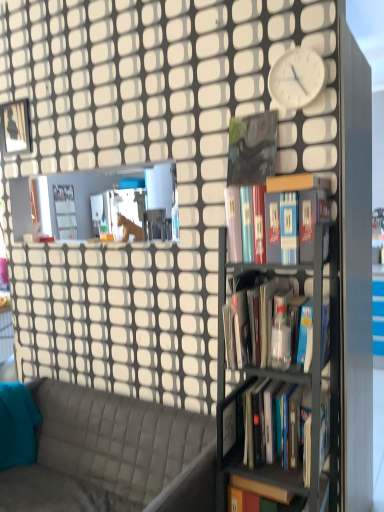
Question: Is metallic gray bookshelf at right directly adjacent to white matte clock at upper right?

Choices:
 (A) no
 (B) yes

Answer: (A)

Question: Is metallic gray bookshelf at right oriented away from white matte clock at upper right?

Choices:
 (A) yes
 (B) no

Answer: (B)

Question: Is metallic gray bookshelf at right wider than white matte clock at upper right?

Choices:
 (A) yes
 (B) no

Answer: (A)

Question: Considering the relative sizes of metallic gray bookshelf at right and white matte clock at upper right in the image provided, is metallic gray bookshelf at right smaller than white matte clock at upper right?

Choices:
 (A) yes
 (B) no

Answer: (B)

Question: From a real-world perspective, is metallic gray bookshelf at right below white matte clock at upper right?

Choices:
 (A) no
 (B) yes

Answer: (B)

Question: Considering their positions, is teal fabric pillow at left located in front of or behind white matte clock at upper right?

Choices:
 (A) behind
 (B) front

Answer: (A)

Question: Considering the positions of point (33, 400) and point (268, 82), is point (33, 400) closer or farther from the camera than point (268, 82)?

Choices:
 (A) farther
 (B) closer

Answer: (A)

Question: Is teal fabric pillow at left situated inside white matte clock at upper right or outside?

Choices:
 (A) inside
 (B) outside

Answer: (B)

Question: Is teal fabric pillow at left bigger or smaller than white matte clock at upper right?

Choices:
 (A) big
 (B) small

Answer: (A)

Question: Considering the relative positions of hardcover books at center, positioned as the first book in bottom-to-top order, and gray quilted fabric couch at lower left in the image provided, is hardcover books at center, positioned as the first book in bottom-to-top order, to the left or to the right of gray quilted fabric couch at lower left?

Choices:
 (A) left
 (B) right

Answer: (B)

Question: From a real-world perspective, relative to gray quilted fabric couch at lower left, is hardcover books at center, the 4th book in the top-to-bottom sequence, vertically above or below?

Choices:
 (A) below
 (B) above

Answer: (B)

Question: Is hardcover books at center, the 4th book in the top-to-bottom sequence, wider or thinner than gray quilted fabric couch at lower left?

Choices:
 (A) thin
 (B) wide

Answer: (A)

Question: Does point (291, 439) appear closer or farther from the camera than point (89, 460)?

Choices:
 (A) farther
 (B) closer

Answer: (B)

Question: Considering their positions, is matte black book at center, the third book when ordered from top to bottom, located in front of or behind black matte book at center, which appears as the 1th book when viewed from the top?

Choices:
 (A) front
 (B) behind

Answer: (A)

Question: Does point (299, 337) appear closer or farther from the camera than point (240, 167)?

Choices:
 (A) farther
 (B) closer

Answer: (B)